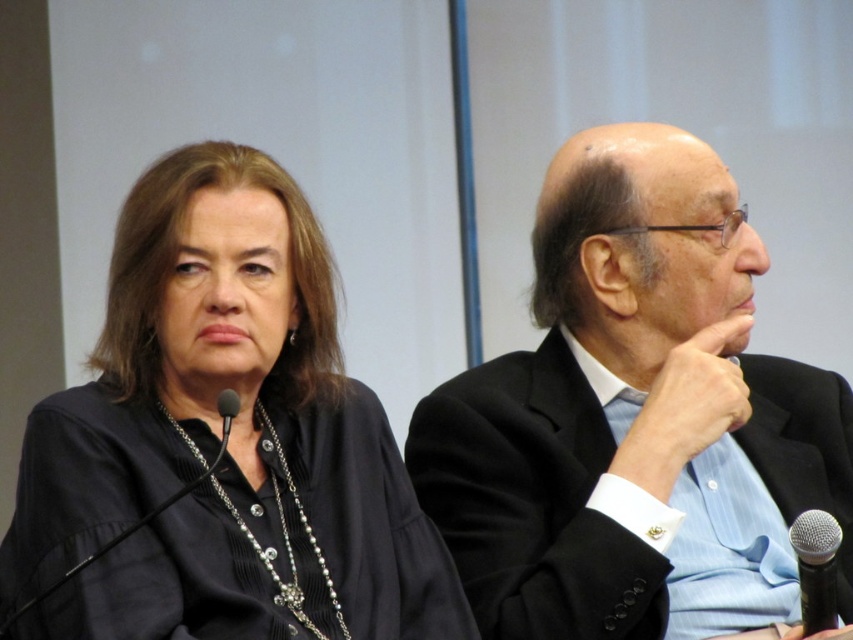
Question: Does black suit at right have a greater width compared to silver metallic microphone at lower right?

Choices:
 (A) no
 (B) yes

Answer: (B)

Question: Is black matte shirt at left smaller than black matte microphone at lower left?

Choices:
 (A) yes
 (B) no

Answer: (B)

Question: Considering the real-world distances, which object is closest to the black matte microphone at lower left?

Choices:
 (A) black matte shirt at left
 (B) black suit at right

Answer: (A)

Question: Which of the following is the farthest from the observer?

Choices:
 (A) (49, 428)
 (B) (566, 320)

Answer: (B)

Question: Does black matte shirt at left come behind silver metallic microphone at lower right?

Choices:
 (A) yes
 (B) no

Answer: (B)

Question: Which of the following is the closest to the observer?

Choices:
 (A) silver metallic microphone at lower right
 (B) black matte shirt at left
 (C) black suit at right

Answer: (B)